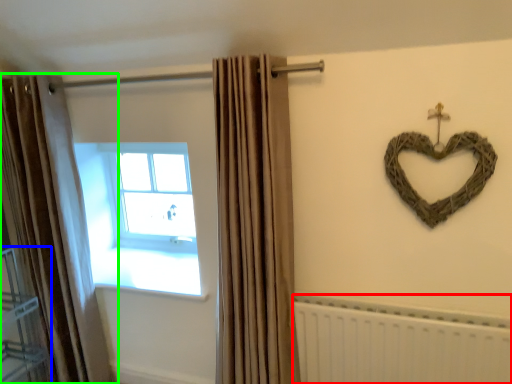
Question: Based on their relative distances, which object is farther from radiator (highlighted by a red box)? Choose from shelf (highlighted by a blue box) and curtain (highlighted by a green box).

Choices:
 (A) shelf
 (B) curtain

Answer: (A)